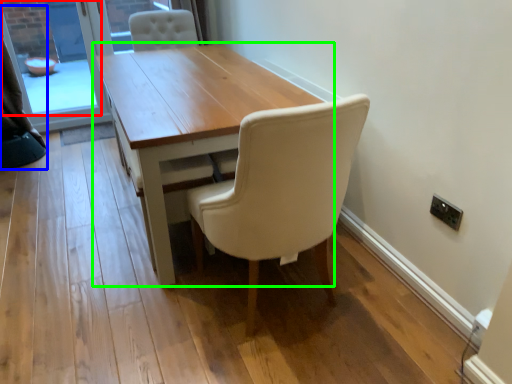
Question: Which is nearer to the window screen (highlighted by a red box)? curtain (highlighted by a blue box) or table (highlighted by a green box).

Choices:
 (A) curtain
 (B) table

Answer: (A)